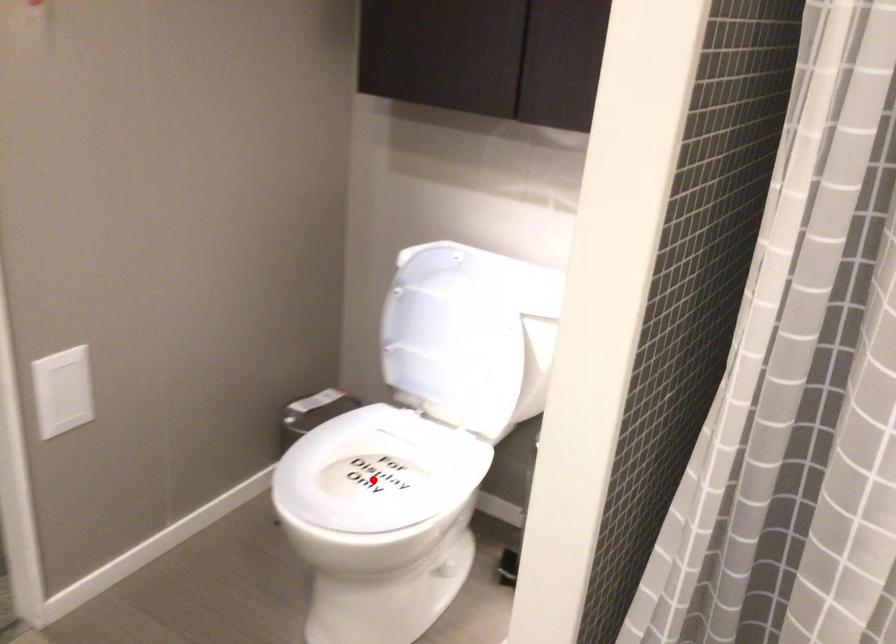
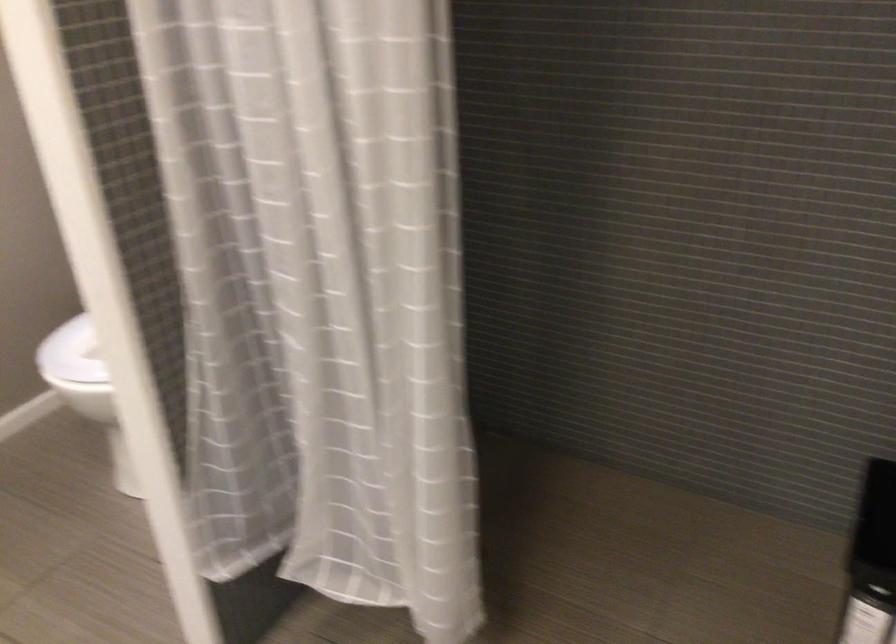
Question: I am providing you with two images of the same scene from different viewpoints. A red point is marked on the first image. At the location where the point appears in image 1, is it still visible in image 2?

Choices:
 (A) Yes
 (B) No

Answer: (B)